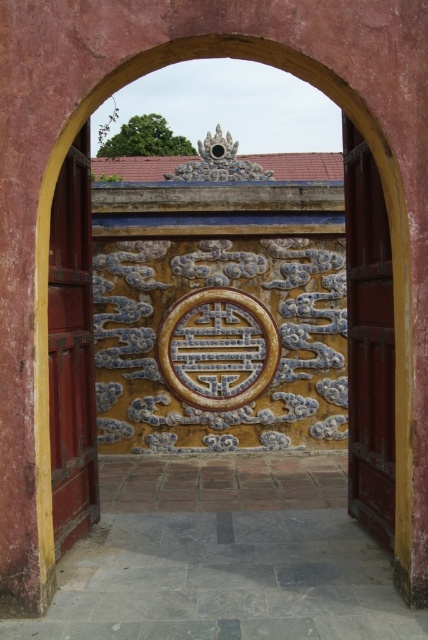
You are standing in front of the gateway and want to open the closest door. Which door should you approach, the smooth red wood door at right or the smooth red wood door at left?

The smooth red wood door at right is closer to you, so you should approach the smooth red wood door at right.

You are an architect designing a replica of this gateway. You need to ensure both doors are symmetrical in their placement. Given that both smooth red wood door at right and smooth red wood door at left are part of the design, which door should be adjusted in height to match the other?

The smooth red wood door at left should be adjusted to match the height of the smooth red wood door at right since the smooth red wood door at right is taller than the smooth red wood door at left according to the description.

You are standing in front of the gateway and want to enter the building through the smooth red wood door at right. Based on its coordinates, is the door located on the right side of the gateway?

Yes, the smooth red wood door at right is located on the right side of the gateway as its coordinates are at point [368,340], which places it on the right side of the gateway.